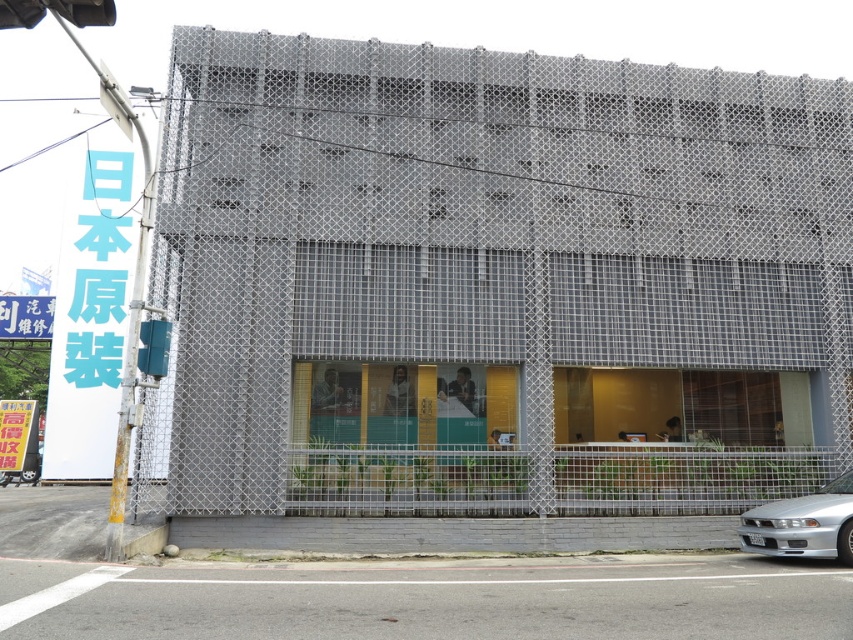
Question: Does matte gray building at center have a smaller size compared to silver metallic car at lower right?

Choices:
 (A) no
 (B) yes

Answer: (A)

Question: Which object is farther from the camera taking this photo?

Choices:
 (A) silver metallic car at lower right
 (B) matte gray building at center

Answer: (B)

Question: Which of the following is the closest to the observer?

Choices:
 (A) matte gray building at center
 (B) silver metallic car at lower right

Answer: (B)

Question: Is matte gray building at center to the left of silver metallic car at lower right from the viewer's perspective?

Choices:
 (A) no
 (B) yes

Answer: (B)

Question: Does matte gray building at center appear on the left side of silver metallic car at lower right?

Choices:
 (A) yes
 (B) no

Answer: (A)